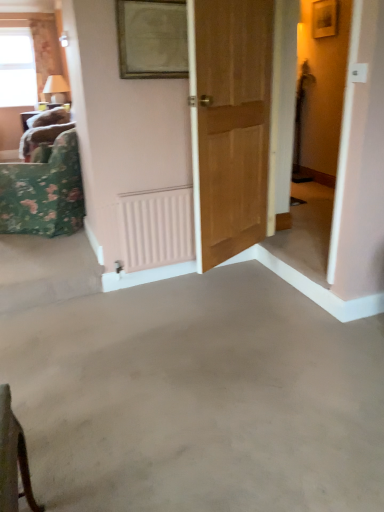
Locate an element on the screen. vacant space situated above pink matte radiator at center (from a real-world perspective) is located at coordinates (155, 187).